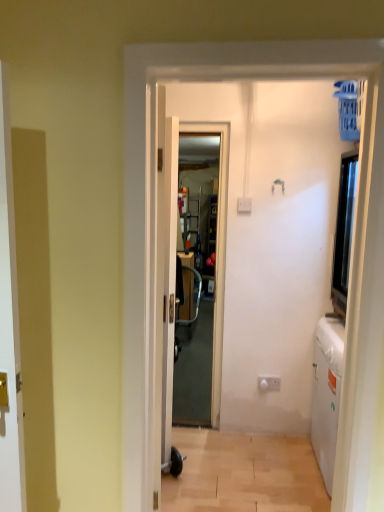
Question: Does transparent plastic screen door at center come behind white glossy electric outlet at lower center?

Choices:
 (A) no
 (B) yes

Answer: (A)

Question: Is transparent plastic screen door at center closer to the viewer compared to white glossy electric outlet at lower center?

Choices:
 (A) no
 (B) yes

Answer: (B)

Question: From the image's perspective, is transparent plastic screen door at center below white glossy electric outlet at lower center?

Choices:
 (A) no
 (B) yes

Answer: (A)

Question: Can you confirm if transparent plastic screen door at center is wider than white glossy electric outlet at lower center?

Choices:
 (A) no
 (B) yes

Answer: (B)

Question: From a real-world perspective, is transparent plastic screen door at center beneath white glossy electric outlet at lower center?

Choices:
 (A) no
 (B) yes

Answer: (A)

Question: From the image's perspective, is transparent plastic screen door at center located above or below white glossy electric outlet at lower center?

Choices:
 (A) above
 (B) below

Answer: (A)

Question: Is transparent plastic screen door at center wider or thinner than white glossy electric outlet at lower center?

Choices:
 (A) thin
 (B) wide

Answer: (B)

Question: Is point (226, 163) positioned closer to the camera than point (258, 386)?

Choices:
 (A) closer
 (B) farther

Answer: (A)

Question: In the image, is transparent plastic screen door at center positioned in front of or behind white glossy electric outlet at lower center?

Choices:
 (A) front
 (B) behind

Answer: (A)

Question: From the image's perspective, is light brown wood floor at lower center positioned above or below transparent plastic screen door at center?

Choices:
 (A) below
 (B) above

Answer: (A)

Question: From a real-world perspective, relative to transparent plastic screen door at center, is light brown wood floor at lower center vertically above or below?

Choices:
 (A) above
 (B) below

Answer: (B)

Question: In the image, is light brown wood floor at lower center on the left side or the right side of transparent plastic screen door at center?

Choices:
 (A) left
 (B) right

Answer: (B)

Question: Is point click(223, 497) closer or farther from the camera than point click(223, 186)?

Choices:
 (A) farther
 (B) closer

Answer: (B)

Question: From the image's perspective, is white glossy electric outlet at lower center above or below transparent plastic screen door at center?

Choices:
 (A) below
 (B) above

Answer: (A)

Question: Is white glossy electric outlet at lower center in front of or behind transparent plastic screen door at center in the image?

Choices:
 (A) behind
 (B) front

Answer: (A)